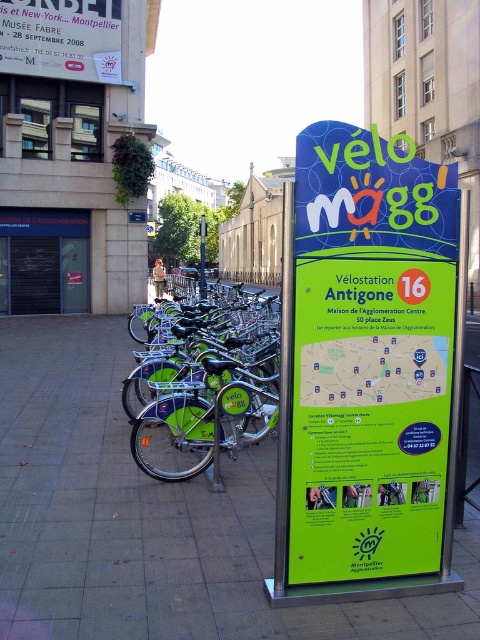
You are a tourist in the city and want to locate the bike station. You see the green plastic sign at center and the metallic gray bus stop at left. Which object should you look to your right of to find the bike station?

The green plastic sign at center is to the right of the metallic gray bus stop at left, so you should look to the right of the metallic gray bus stop at left to find the bike station.

You are a tourist standing at the metallic gray bus stop at left and want to reach the green metal pavement at center. Which direction should you move to get there?

The green metal pavement at center is positioned on the right side of the metallic gray bus stop at left, so you should move to your right to reach it.

You are a tourist in the city and want to find a place to park your car. You see the green metal pavement at center and the metallic gray bus stop at left. Which one is more likely to be a parking area?

The green metal pavement at center is more likely to be a parking area since it has a larger size compared to the metallic gray bus stop at left.